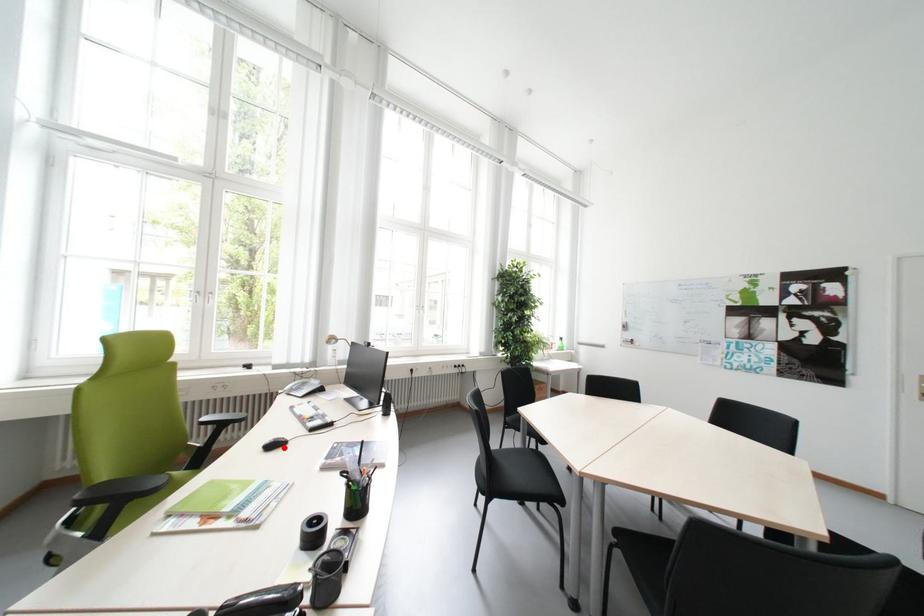
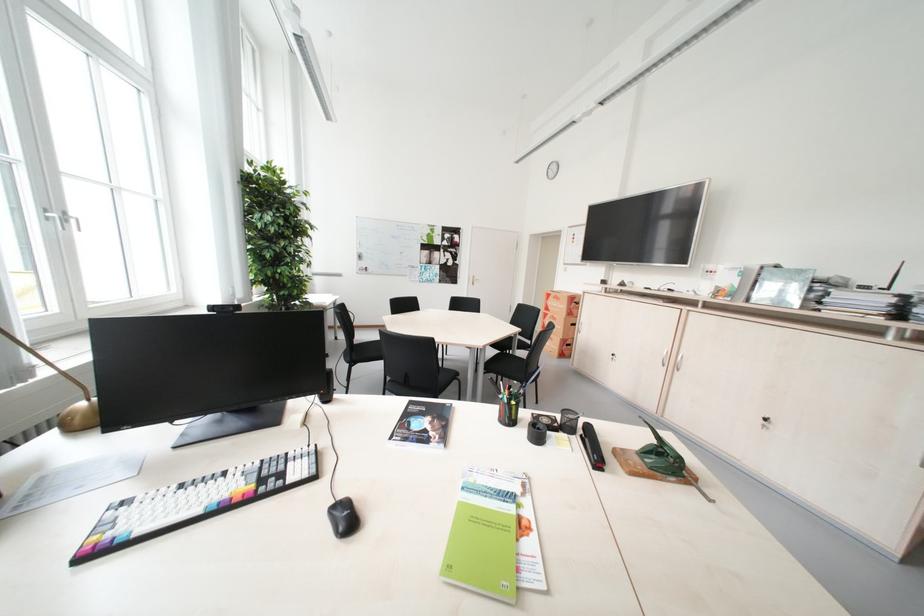
Question: I am providing you with two images of the same scene from different viewpoints. A red point is marked on the first image. At the location where the point appears in image 1, is it still visible in image 2?

Choices:
 (A) Yes
 (B) No

Answer: (A)